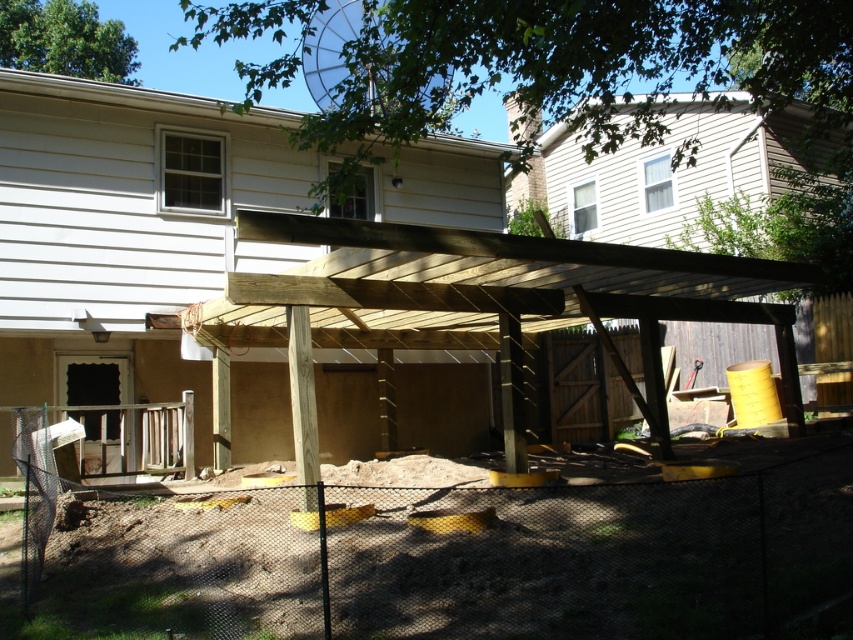
Question: Which point appears farthest from the camera in this image?

Choices:
 (A) (136, 429)
 (B) (44, 257)

Answer: (A)

Question: Is black mesh fence at lower center further to the viewer compared to wooden fence at lower left?

Choices:
 (A) no
 (B) yes

Answer: (A)

Question: Is wooden pergola at center behind wooden fence at lower left?

Choices:
 (A) yes
 (B) no

Answer: (B)

Question: Which of the following is the closest to the observer?

Choices:
 (A) black mesh fence at lower center
 (B) wooden pergola at center
 (C) wooden fence at lower left

Answer: (B)

Question: Does wooden pergola at center appear on the right side of wooden fence at lower left?

Choices:
 (A) no
 (B) yes

Answer: (B)

Question: Which point appears closest to the camera in this image?

Choices:
 (A) (125, 474)
 (B) (265, 108)

Answer: (A)